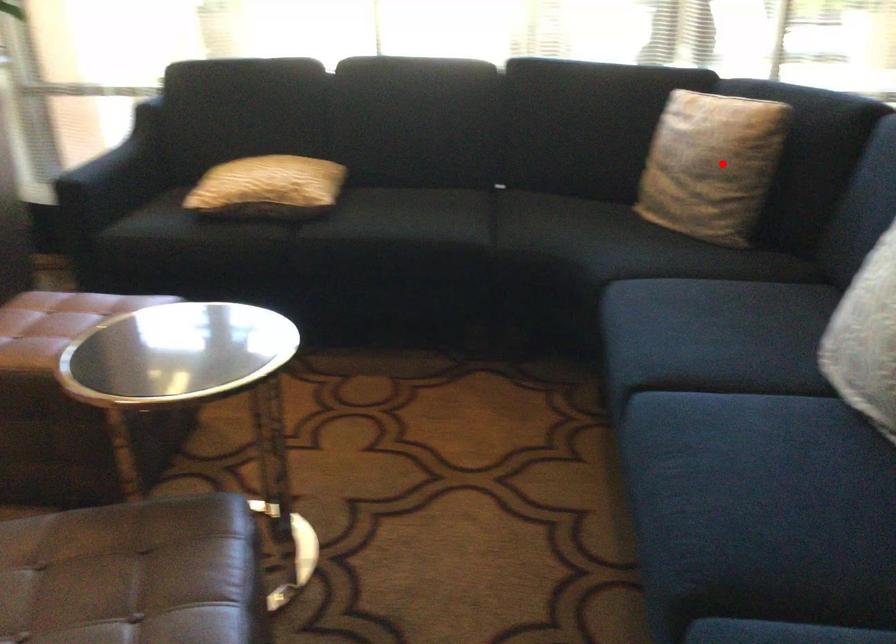
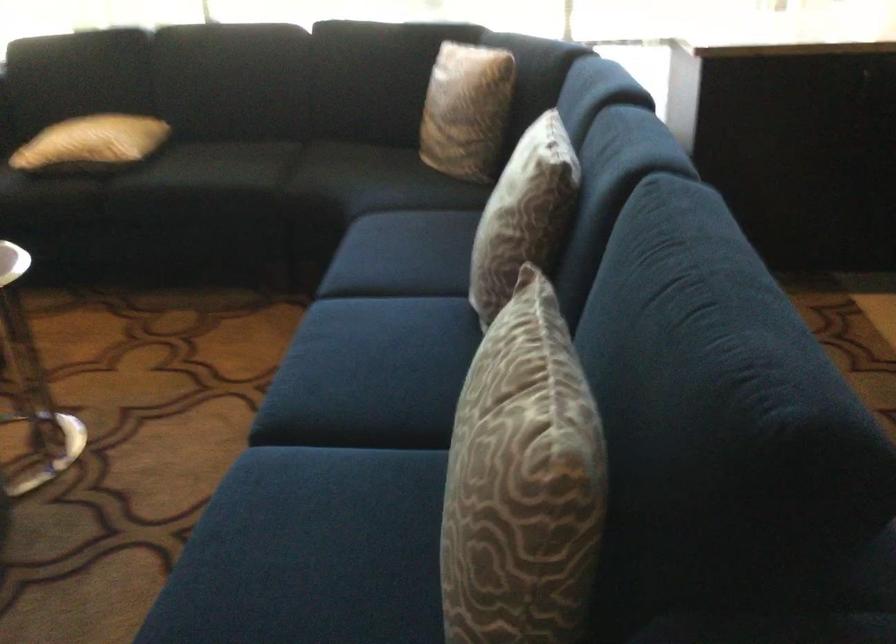
Question: I am providing you with two images of the same scene from different viewpoints. Given a red point in image1, look at the same physical point in image2. Is it:

Choices:
 (A) Closer to the viewpoint
 (B) Farther from the viewpoint

Answer: (B)